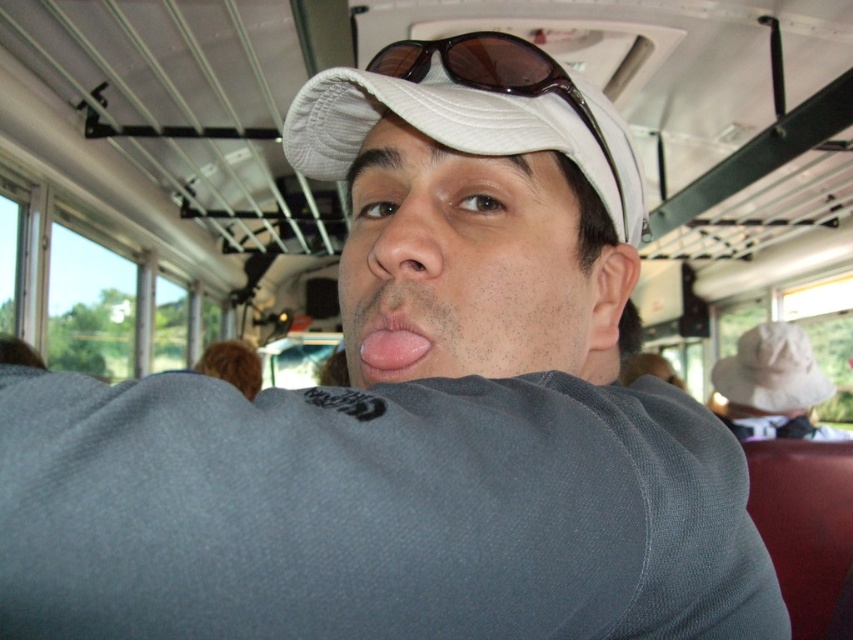
Does matte gray face at center lie behind white fabric cap at center?

No, matte gray face at center is closer to the viewer.

Can you confirm if matte gray face at center is shorter than white fabric cap at center?

No, matte gray face at center is not shorter than white fabric cap at center.

Locate an element on the screen. The image size is (853, 640). matte gray face at center is located at coordinates (469, 264).

What are the coordinates of `white fabric hat at upper center` in the screenshot? It's located at (770, 372).

Does white fabric hat at upper center have a greater height compared to matte skin nose at center?

Indeed, white fabric hat at upper center has a greater height compared to matte skin nose at center.

Find the location of a particular element. The height and width of the screenshot is (640, 853). white fabric hat at upper center is located at coordinates (770, 372).

Which of these two, matte skin nose at center or pink flesh at center, stands shorter?

pink flesh at center

Does matte skin nose at center appear under pink flesh at center?

Actually, matte skin nose at center is above pink flesh at center.

The image size is (853, 640). In order to click on matte skin nose at center in this screenshot , I will do `click(399, 234)`.

You are a GUI agent. You are given a task and a screenshot of the screen. Output one action in this format:
    pyautogui.click(x=<x>, y=<y>)
    Task: Click on the matte skin nose at center
    The height and width of the screenshot is (640, 853).
    Given the screenshot: What is the action you would take?
    pos(399,234)